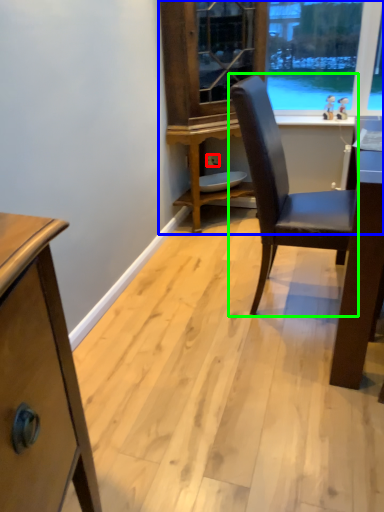
Question: Which object is positioned closest to power outlet (highlighted by a red box)? Select from dresser (highlighted by a blue box) and chair (highlighted by a green box).

Choices:
 (A) dresser
 (B) chair

Answer: (A)